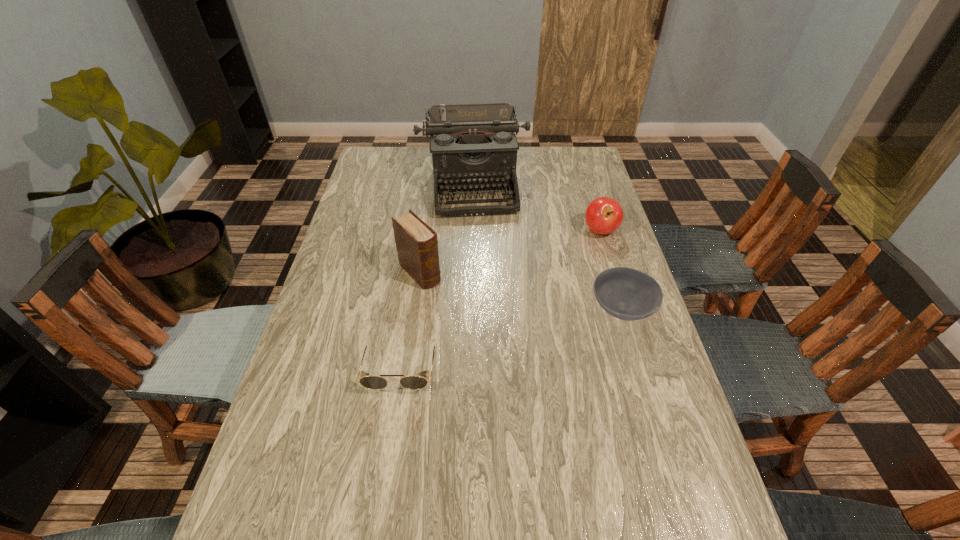
The width and height of the screenshot is (960, 540). I want to click on free space located on the typing side of the typewriter, so click(481, 256).

Find the location of a particular element. vacant space situated on the typing side of the typewriter is located at coordinates (485, 288).

Locate an element on the screen. The image size is (960, 540). vacant space located on the typing side of the typewriter is located at coordinates (479, 243).

At what (x,y) coordinates should I click in order to perform the action: click on vacant space located 0.380m on the stem of the third shortest object. Please return your answer as a coordinate pair (x, y). Looking at the image, I should click on (522, 308).

Where is `free space located on the stem of the third shortest object`? The image size is (960, 540). free space located on the stem of the third shortest object is located at coordinates 520,310.

Find the location of a particular element. The height and width of the screenshot is (540, 960). free space located 0.160m on the stem of the third shortest object is located at coordinates (564, 266).

This screenshot has width=960, height=540. In order to click on object positioned at the far edge in this screenshot , I will do `click(473, 145)`.

Where is `bowl that is at the right edge`? bowl that is at the right edge is located at coordinates (625, 293).

At what (x,y) coordinates should I click in order to perform the action: click on apple situated at the right edge. Please return your answer as a coordinate pair (x, y). Looking at the image, I should click on (604, 215).

Where is `free region at the near edge of the desktop`? This screenshot has width=960, height=540. free region at the near edge of the desktop is located at coordinates (573, 500).